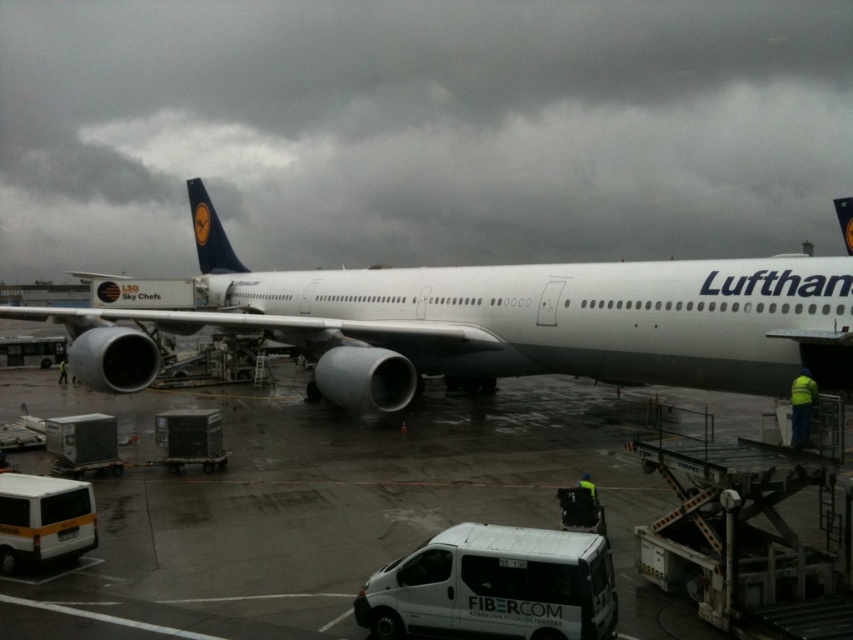
Between point (743, 308) and point (523, 579), which one is positioned behind?

Positioned behind is point (743, 308).

Is white metallic airplane at center closer to the viewer compared to white matte van at lower center?

That is False.

Who is more distant from viewer, (798, 291) or (515, 544)?

Point (798, 291)

In order to click on white metallic airplane at center in this screenshot , I will do `click(497, 323)`.

Which is in front, point (354, 316) or point (68, 541)?

Point (68, 541)

Which is below, white metallic airplane at center or white matte van at lower left?

Positioned lower is white matte van at lower left.

Does point (700, 280) come behind point (12, 508)?

Yes.

I want to click on white metallic airplane at center, so click(497, 323).

Is white matte van at lower center smaller than white matte van at lower left?

No.

Who is more forward, (608, 630) or (55, 496)?

Point (608, 630) is more forward.

What are the coordinates of `white matte van at lower center` in the screenshot? It's located at (494, 586).